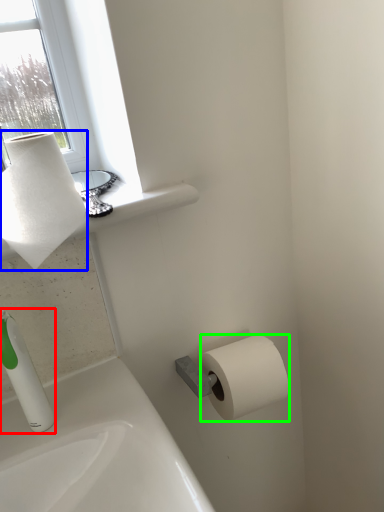
Question: Based on their relative distances, which object is nearer to soap dispenser (highlighted by a red box)? Choose from paper towel (highlighted by a blue box) and toilet paper (highlighted by a green box).

Choices:
 (A) paper towel
 (B) toilet paper

Answer: (A)